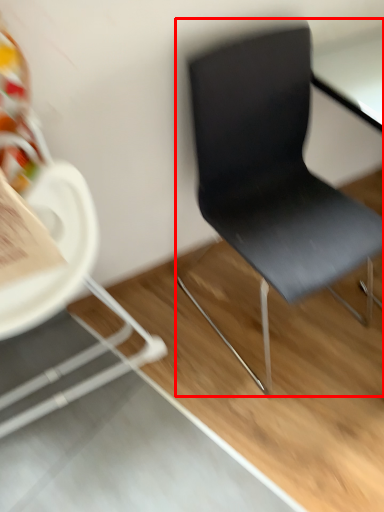
Question: Where is chair (annotated by the red box) located in relation to chair in the image?

Choices:
 (A) left
 (B) right

Answer: (B)